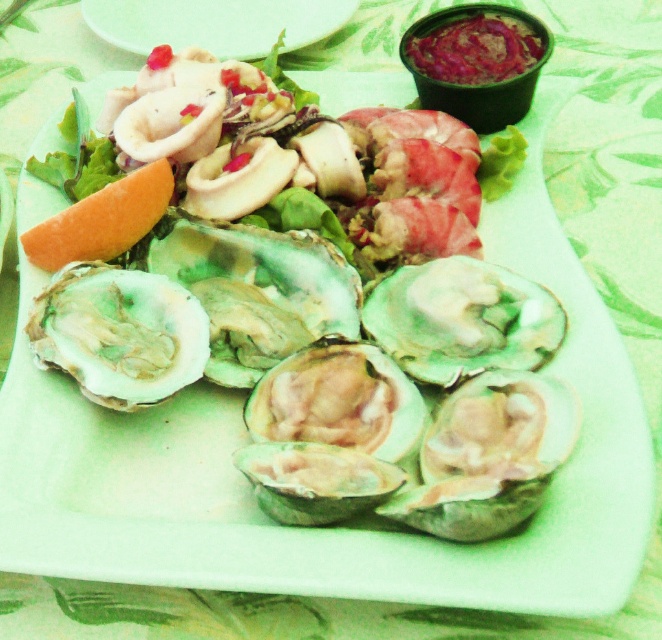
You are a food stylist arranging a seafood platter. You have a greenish shell oyster at center and a white glossy plate at upper center. Where should you place the garnish to ensure it is between the two items?

The garnish should be placed between the greenish shell oyster at center and the white glossy plate at upper center, since the oyster is to the left of the plate.

Based on the photo, you are a food stylist arranging a seafood platter. You have a greenish shell oyster at center and a white glossy plate at upper center. Where should you place the oyster in relation to the plate to maintain the arrangement shown?

The greenish shell oyster at center should be placed below the white glossy plate at upper center as shown in the arrangement.

From the picture: You are a food critic sitting at a table 30 inches away from the greenish shell oyster at center on the serving tray. Can you comfortably reach the oyster with your hand to taste it without moving your chair?

The distance between you and the greenish shell oyster at center is 29.62 inches. Since you are 30 inches away, you can just barely reach it by stretching your arm forward, but it might be a bit uncomfortable. Consider moving your chair closer for better access.